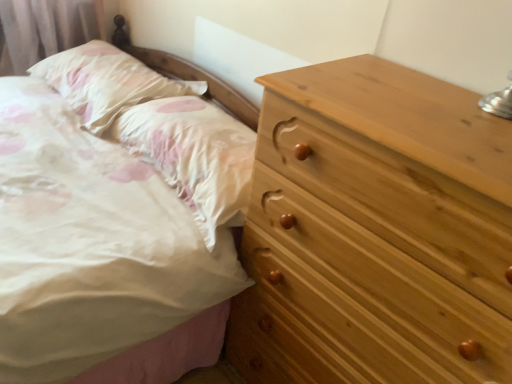
What is the approximate height of white satin pillow at upper left, acting as the 2th pillow starting from the right?

white satin pillow at upper left, acting as the 2th pillow starting from the right, is 16.75 centimeters in height.

The width and height of the screenshot is (512, 384). In order to click on white satin pillow at upper left, which appears as the 1th pillow when viewed from the right in this screenshot , I will do `click(194, 156)`.

From a real-world perspective, which is physically below, white satin pillow at upper left, which is counted as the 2th pillow, starting from the left, or natural wood chest of drawers at right?

natural wood chest of drawers at right is physically lower.

Is white satin pillow at upper left, which is counted as the 2th pillow, starting from the left, looking in the opposite direction of natural wood chest of drawers at right?

white satin pillow at upper left, which is counted as the 2th pillow, starting from the left, does not have its back to natural wood chest of drawers at right.

How distant is white satin pillow at upper left, which appears as the 1th pillow when viewed from the right, from natural wood chest of drawers at right?

A distance of 14.14 inches exists between white satin pillow at upper left, which appears as the 1th pillow when viewed from the right, and natural wood chest of drawers at right.

How many degrees apart are the facing directions of white satin pillow at upper left, which is counted as the 2th pillow, starting from the left, and natural wood chest of drawers at right?

white satin pillow at upper left, which is counted as the 2th pillow, starting from the left, and natural wood chest of drawers at right are facing 1.76 degrees away from each other.

Does white satin pillow at upper left, the 1th pillow viewed from the left, appear on the left side of white satin pillow at upper left, which is counted as the 2th pillow, starting from the left?

Indeed, white satin pillow at upper left, the 1th pillow viewed from the left, is positioned on the left side of white satin pillow at upper left, which is counted as the 2th pillow, starting from the left.

What's the angular difference between white satin pillow at upper left, the 1th pillow viewed from the left, and white satin pillow at upper left, which appears as the 1th pillow when viewed from the right,'s facing directions?

The angular difference between white satin pillow at upper left, the 1th pillow viewed from the left, and white satin pillow at upper left, which appears as the 1th pillow when viewed from the right, is 0.000417 degrees.

Is white satin pillow at upper left, the 1th pillow viewed from the left, wider or thinner than white satin pillow at upper left, which appears as the 1th pillow when viewed from the right?

In the image, white satin pillow at upper left, the 1th pillow viewed from the left, appears to be more narrow than white satin pillow at upper left, which appears as the 1th pillow when viewed from the right.

Is white satin pillow at upper left, acting as the 2th pillow starting from the right, directly adjacent to white satin pillow at upper left, which is counted as the 2th pillow, starting from the left?

No.

In order to click on chest of drawers below the white satin pillow at upper left, acting as the 2th pillow starting from the right (from the image's perspective) in this screenshot , I will do `click(375, 232)`.

Who is bigger, natural wood chest of drawers at right or white satin pillow at upper left, the 1th pillow viewed from the left?

Bigger between the two is natural wood chest of drawers at right.

Considering the relative positions of natural wood chest of drawers at right and white satin pillow at upper left, the 1th pillow viewed from the left, in the image provided, is natural wood chest of drawers at right in front of white satin pillow at upper left, the 1th pillow viewed from the left,?

Yes.

From a real-world perspective, is natural wood chest of drawers at right positioned above or below white satin pillow at upper left, the 1th pillow viewed from the left?

In terms of real-world spatial position, natural wood chest of drawers at right is below white satin pillow at upper left, the 1th pillow viewed from the left.

Which is behind, point (298, 329) or point (203, 207)?

Point (203, 207)

Is natural wood chest of drawers at right shorter than white satin pillow at upper left, which appears as the 1th pillow when viewed from the right?

Incorrect, the height of natural wood chest of drawers at right does not fall short of that of white satin pillow at upper left, which appears as the 1th pillow when viewed from the right.

Which of these two, natural wood chest of drawers at right or white satin pillow at upper left, which appears as the 1th pillow when viewed from the right, is thinner?

white satin pillow at upper left, which appears as the 1th pillow when viewed from the right.

Is natural wood chest of drawers at right positioned with its back to white satin pillow at upper left, which is counted as the 2th pillow, starting from the left?

No.

From the picture: Which object is closer to the camera taking this photo, white satin pillow at upper left, the 1th pillow viewed from the left, or natural wood chest of drawers at right?

natural wood chest of drawers at right is in front.

Based on their positions, is white satin pillow at upper left, the 1th pillow viewed from the left, located to the left or right of natural wood chest of drawers at right?

In the image, white satin pillow at upper left, the 1th pillow viewed from the left, appears on the left side of natural wood chest of drawers at right.

Considering the sizes of objects white satin pillow at upper left, acting as the 2th pillow starting from the right, and natural wood chest of drawers at right in the image provided, who is thinner, white satin pillow at upper left, acting as the 2th pillow starting from the right, or natural wood chest of drawers at right?

white satin pillow at upper left, acting as the 2th pillow starting from the right.

From the image's perspective, is white satin pillow at upper left, acting as the 2th pillow starting from the right, located beneath natural wood chest of drawers at right?

No, from the image's perspective, white satin pillow at upper left, acting as the 2th pillow starting from the right, is not below natural wood chest of drawers at right.

Can you confirm if white satin pillow at upper left, which is counted as the 2th pillow, starting from the left, is thinner than white satin pillow at upper left, acting as the 2th pillow starting from the right?

Incorrect, the width of white satin pillow at upper left, which is counted as the 2th pillow, starting from the left, is not less than that of white satin pillow at upper left, acting as the 2th pillow starting from the right.

Does white satin pillow at upper left, which appears as the 1th pillow when viewed from the right, have a smaller size compared to white satin pillow at upper left, the 1th pillow viewed from the left?

No, white satin pillow at upper left, which appears as the 1th pillow when viewed from the right, is not smaller than white satin pillow at upper left, the 1th pillow viewed from the left.

Does white satin pillow at upper left, which is counted as the 2th pillow, starting from the left, lie in front of white satin pillow at upper left, the 1th pillow viewed from the left?

Yes, white satin pillow at upper left, which is counted as the 2th pillow, starting from the left, is in front of white satin pillow at upper left, the 1th pillow viewed from the left.

Can you confirm if white satin pillow at upper left, which appears as the 1th pillow when viewed from the right, is positioned to the right of white satin pillow at upper left, the 1th pillow viewed from the left?

Yes, white satin pillow at upper left, which appears as the 1th pillow when viewed from the right, is to the right of white satin pillow at upper left, the 1th pillow viewed from the left.

From a real-world perspective, which pillow is the 1st one above the natural wood chest of drawers at right? Please provide its 2D coordinates.

[(194, 156)]

Where is `pillow below the white satin pillow at upper left, acting as the 2th pillow starting from the right (from a real-world perspective)`? pillow below the white satin pillow at upper left, acting as the 2th pillow starting from the right (from a real-world perspective) is located at coordinates (194, 156).

Looking at the image, which one is located further to white satin pillow at upper left, which appears as the 1th pillow when viewed from the right, white satin pillow at upper left, acting as the 2th pillow starting from the right, or natural wood chest of drawers at right?

Based on the image, natural wood chest of drawers at right appears to be further to white satin pillow at upper left, which appears as the 1th pillow when viewed from the right.

Looking at this image, which object lies nearer to the anchor point natural wood chest of drawers at right, white satin pillow at upper left, the 1th pillow viewed from the left, or white satin pillow at upper left, which is counted as the 2th pillow, starting from the left?

Based on the image, white satin pillow at upper left, which is counted as the 2th pillow, starting from the left, appears to be nearer to natural wood chest of drawers at right.

Considering their positions, is natural wood chest of drawers at right positioned further to white satin pillow at upper left, acting as the 2th pillow starting from the right, than white satin pillow at upper left, which is counted as the 2th pillow, starting from the left?

natural wood chest of drawers at right lies further to white satin pillow at upper left, acting as the 2th pillow starting from the right, than the other object.

From the image, which object appears to be nearer to white satin pillow at upper left, acting as the 2th pillow starting from the right, white satin pillow at upper left, which is counted as the 2th pillow, starting from the left, or natural wood chest of drawers at right?

white satin pillow at upper left, which is counted as the 2th pillow, starting from the left, is positioned closer to the anchor white satin pillow at upper left, acting as the 2th pillow starting from the right.

From the image, which object appears to be farther from white satin pillow at upper left, which is counted as the 2th pillow, starting from the left, natural wood chest of drawers at right or white satin pillow at upper left, acting as the 2th pillow starting from the right?

Based on the image, natural wood chest of drawers at right appears to be further to white satin pillow at upper left, which is counted as the 2th pillow, starting from the left.

From the picture: Looking at the image, which one is located closer to natural wood chest of drawers at right, white satin pillow at upper left, which is counted as the 2th pillow, starting from the left, or white satin pillow at upper left, acting as the 2th pillow starting from the right?

white satin pillow at upper left, which is counted as the 2th pillow, starting from the left, is closer to natural wood chest of drawers at right.

You are a GUI agent. You are given a task and a screenshot of the screen. Output one action in this format:
    pyautogui.click(x=<x>, y=<y>)
    Task: Click on the pillow between white satin pillow at upper left, acting as the 2th pillow starting from the right, and natural wood chest of drawers at right, in the horizontal direction
    
    Given the screenshot: What is the action you would take?
    [x=194, y=156]